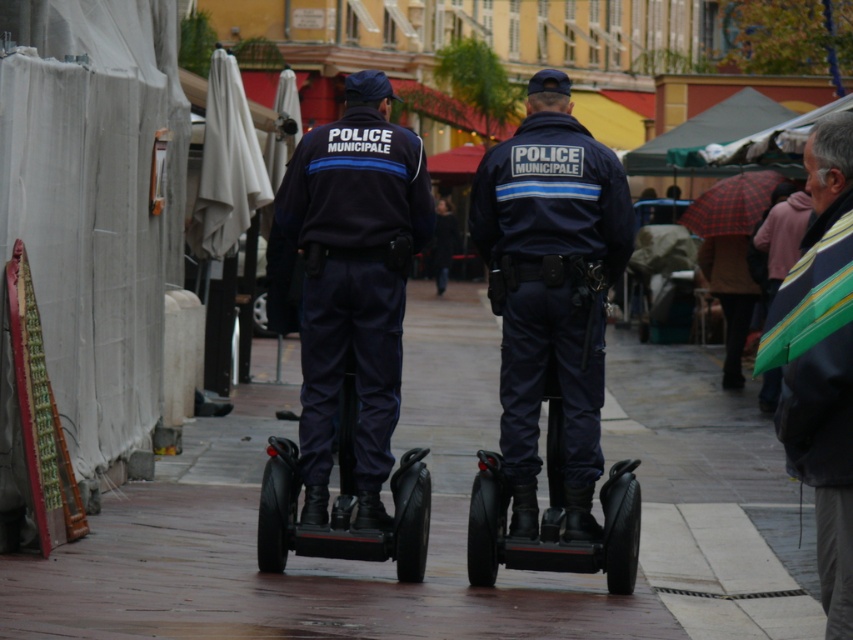
You are a pedestrian trying to cross the square safely. There is a black rubber segway at center and a navy blue uniform at center. Which object is closer to you?

The black rubber segway at center is positioned under the navy blue uniform at center, so the segway is closer to you.